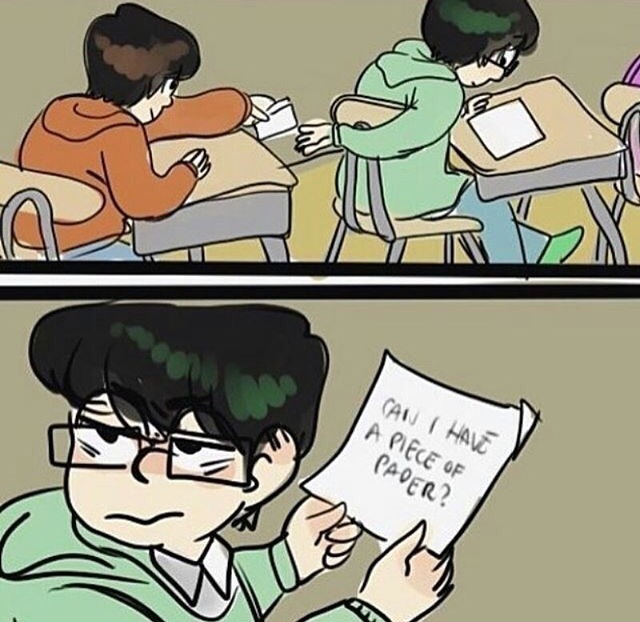
Locate an element on the screen. The height and width of the screenshot is (622, 640). chair is located at coordinates (36, 182), (399, 214), (626, 96).